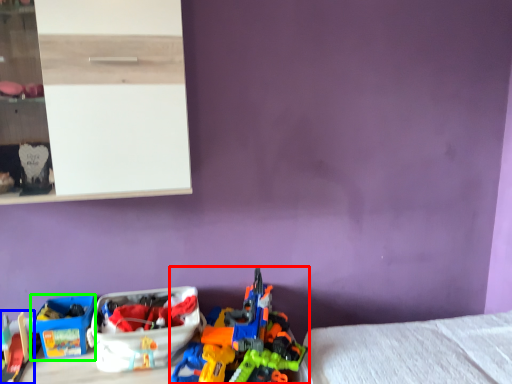
Question: Which is nearer to the toy (highlighted by a red box)? toy (highlighted by a blue box) or storage box (highlighted by a green box).

Choices:
 (A) toy
 (B) storage box

Answer: (B)